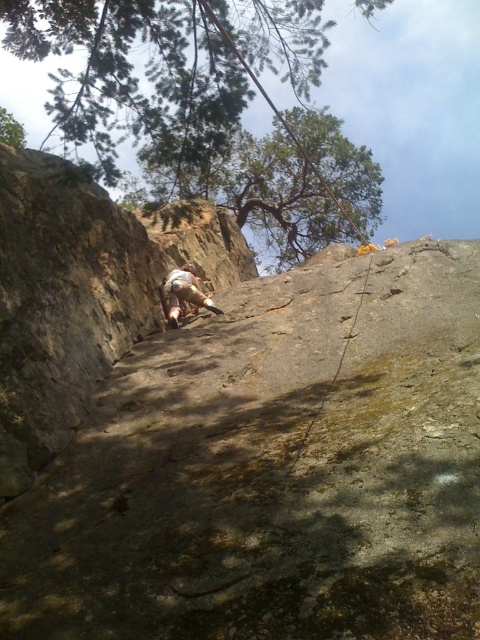
Consider the image. Does green leafy tree at upper left appear under tan fabric pants at center?

Actually, green leafy tree at upper left is above tan fabric pants at center.

Can you confirm if green leafy tree at upper left is positioned to the left of tan fabric pants at center?

Correct, you'll find green leafy tree at upper left to the left of tan fabric pants at center.

Identify the location of green leafy tree at upper left. (164, 64).